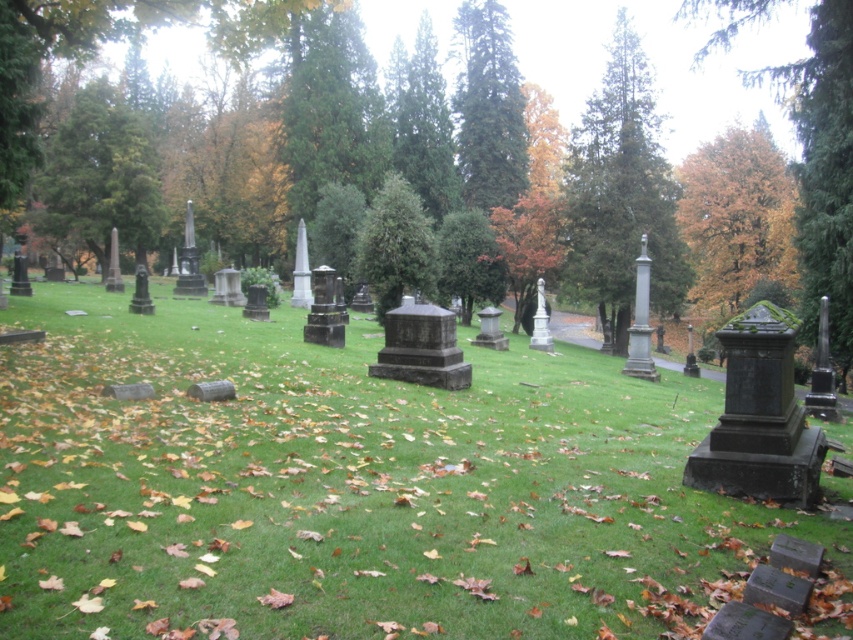
Question: Estimate the real-world distances between objects in this image. Which object is farther from the green textured tree at upper left?

Choices:
 (A) green leafy tree at center
 (B) orange matte tree at center

Answer: (B)

Question: Is green textured tree at upper left thinner than green leafy tree at center?

Choices:
 (A) no
 (B) yes

Answer: (A)

Question: Is green textured tree at upper center thinner than green leafy tree at center?

Choices:
 (A) yes
 (B) no

Answer: (B)

Question: Does green grassy at center come in front of green leafy tree at center?

Choices:
 (A) no
 (B) yes

Answer: (B)

Question: Which point is closer to the camera?

Choices:
 (A) orange leafy tree at upper right
 (B) green grassy at center
 (C) green textured tree at upper left

Answer: (B)

Question: Among these objects, which one is farthest from the camera?

Choices:
 (A) green grassy at center
 (B) orange leafy tree at upper right
 (C) golden-brown foliage at center

Answer: (B)